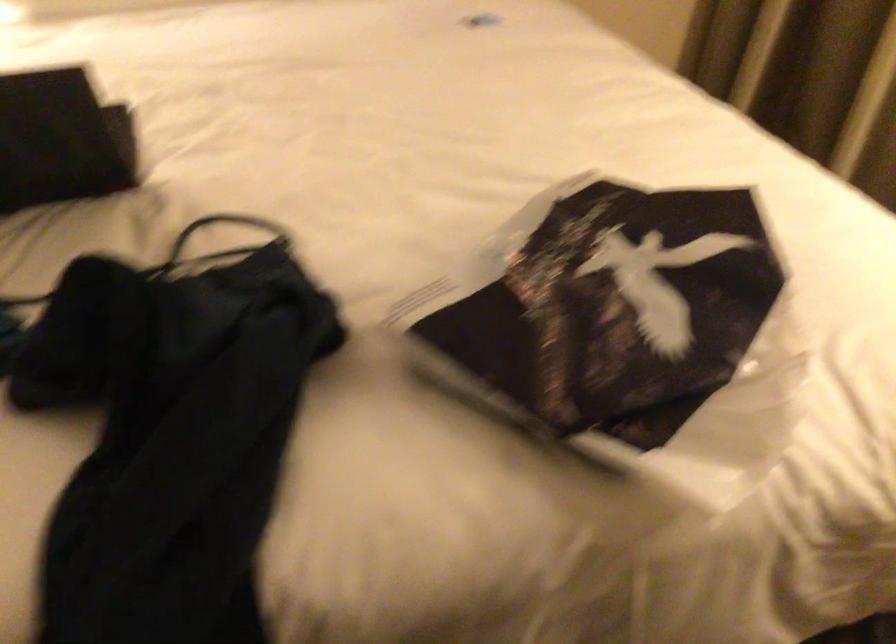
Where is `graphic paper bag`? The image size is (896, 644). graphic paper bag is located at coordinates (605, 307).